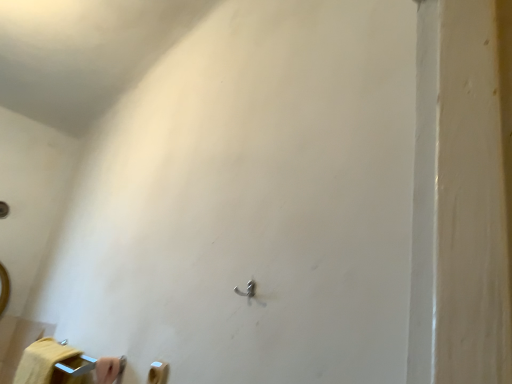
In order to face yellow fabric towel at lower left, should I rotate leftwards or rightwards?

To align with it, rotate left about 24.923°.

This screenshot has width=512, height=384. What do you see at coordinates (41, 361) in the screenshot?
I see `yellow fabric towel at lower left` at bounding box center [41, 361].

What is the approximate height of yellow fabric towel at lower left?

3.27 inches.

Locate an element on the screen. This screenshot has height=384, width=512. yellow fabric towel at lower left is located at coordinates (41, 361).

Identify the location of yellow fabric towel at lower left. This screenshot has height=384, width=512. (41, 361).